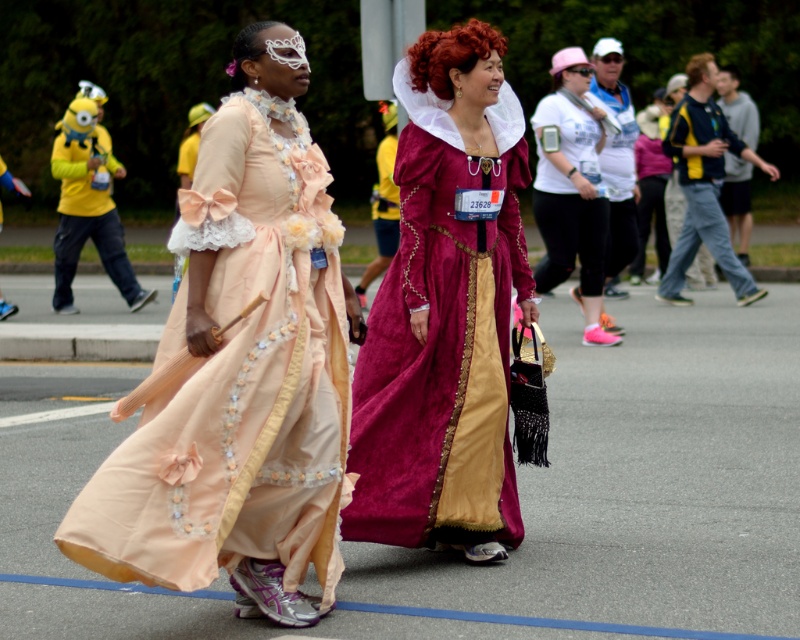
Does curly red wig at upper center appear over white lace wig at upper center?

Yes.

Between curly red wig at upper center and white lace wig at upper center, which one appears on the right side from the viewer's perspective?

curly red wig at upper center

You are a GUI agent. You are given a task and a screenshot of the screen. Output one action in this format:
    pyautogui.click(x=<x>, y=<y>)
    Task: Click on the curly red wig at upper center
    
    Given the screenshot: What is the action you would take?
    pyautogui.click(x=450, y=54)

Can you confirm if yellow plush toy at left is positioned to the left of curly red wig at upper center?

Yes, yellow plush toy at left is to the left of curly red wig at upper center.

Identify the location of yellow plush toy at left. The image size is (800, 640). (88, 202).

Is point (66, 195) positioned in front of point (466, 61)?

No, it is not.

Where is `yellow plush toy at left`? This screenshot has width=800, height=640. yellow plush toy at left is located at coordinates [88, 202].

Is white fabric at center below curly red wig at upper center?

Yes.

Does white fabric at center have a lesser width compared to curly red wig at upper center?

Yes, white fabric at center is thinner than curly red wig at upper center.

Which is behind, point (550, 186) or point (444, 88)?

Positioned behind is point (550, 186).

Locate an element on the screen. white fabric at center is located at coordinates (570, 196).